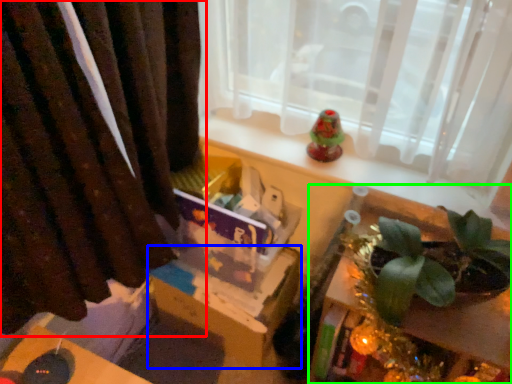
Question: Based on their relative distances, which object is nearer to curtain (highlighted by a red box)? Choose from cardboard box (highlighted by a blue box) and table (highlighted by a green box).

Choices:
 (A) cardboard box
 (B) table

Answer: (A)